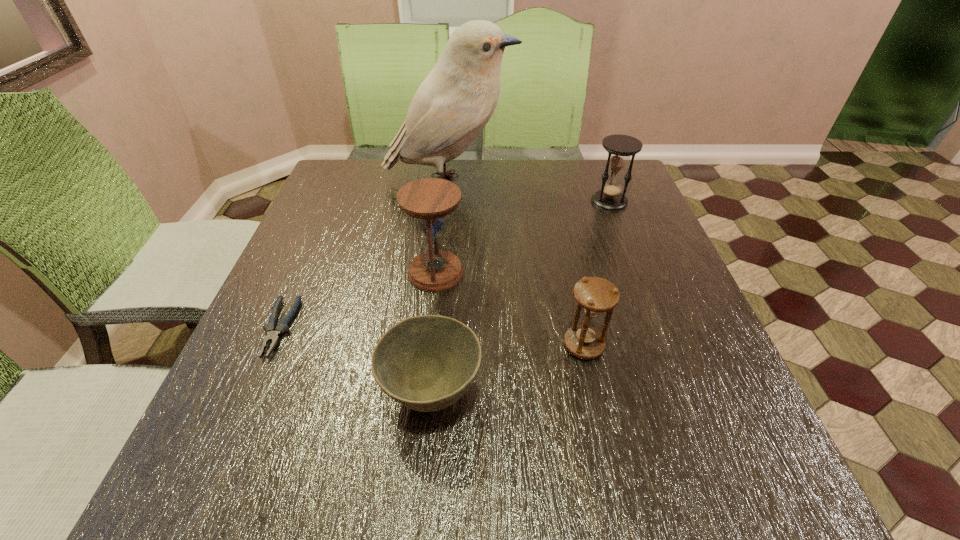
At what (x,y) coordinates should I click in order to perform the action: click on blank region between the second hourglass from right to left and the fifth shortest object. Please return your answer as a coordinate pair (x, y). Looking at the image, I should click on (510, 309).

Locate an element on the screen. free spot between the nearest hourglass and the rightmost object is located at coordinates point(596,273).

You are a GUI agent. You are given a task and a screenshot of the screen. Output one action in this format:
    pyautogui.click(x=<x>, y=<y>)
    Task: Click on the unoccupied position between the parakeet and the shortest object
    
    Given the screenshot: What is the action you would take?
    pyautogui.click(x=364, y=255)

What are the coordinates of `free spot between the rightmost object and the fifth shortest object` in the screenshot? It's located at (522, 237).

Where is `the second closest object to the leftmost object`? Image resolution: width=960 pixels, height=540 pixels. the second closest object to the leftmost object is located at coordinates (x=429, y=200).

The width and height of the screenshot is (960, 540). What are the coordinates of `object that is the fourth closest one to the shortest object` in the screenshot? It's located at (594, 295).

At what (x,y) coordinates should I click in order to perform the action: click on hourglass that is the second closest to the nearest hourglass. Please return your answer as a coordinate pair (x, y). Looking at the image, I should click on (620, 147).

I want to click on hourglass that is the third closest to the tallest object, so click(x=594, y=295).

Where is `vacant space that satisfies the following two spatial constraints: 1. on the back side of the second hourglass from left to right; 2. on the face of the tallest object`? Image resolution: width=960 pixels, height=540 pixels. vacant space that satisfies the following two spatial constraints: 1. on the back side of the second hourglass from left to right; 2. on the face of the tallest object is located at coordinates (548, 182).

Find the location of a particular element. Image resolution: width=960 pixels, height=540 pixels. vacant region that satisfies the following two spatial constraints: 1. at the gripping part of the second shortest object; 2. on the left side of the leftmost object is located at coordinates (252, 393).